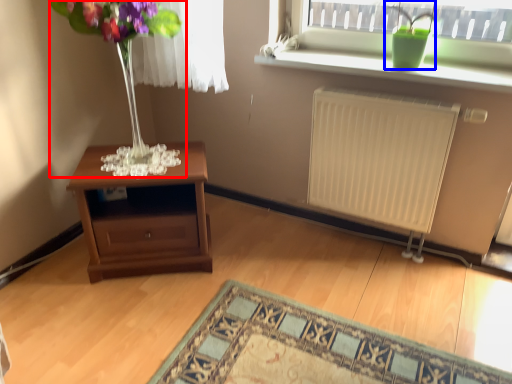
Question: Which object appears farthest to the camera in this image, bouquet (highlighted by a red box) or houseplant (highlighted by a blue box)?

Choices:
 (A) bouquet
 (B) houseplant

Answer: (B)